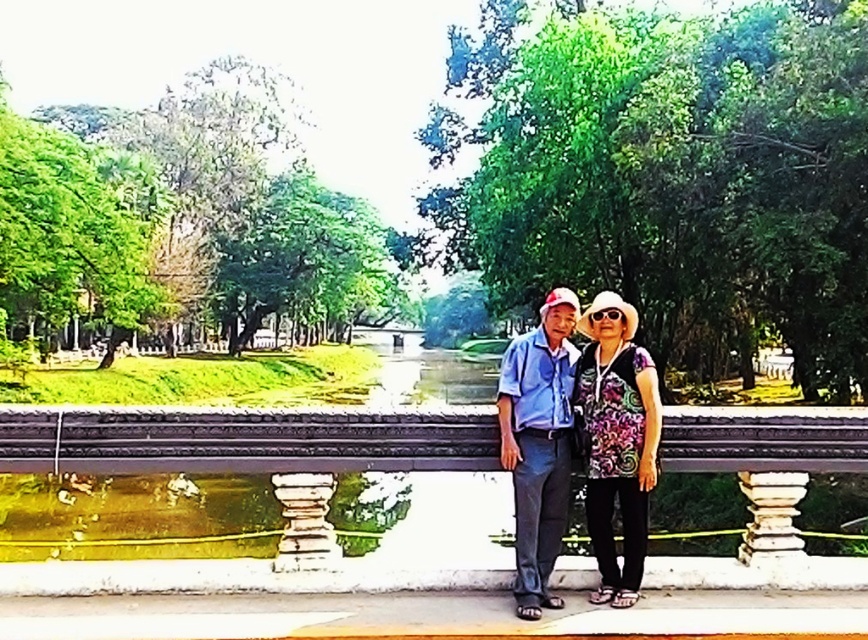
Question: Is black textured rail at center closer to camera compared to blue cotton shirt at center?

Choices:
 (A) no
 (B) yes

Answer: (B)

Question: Can you confirm if black textured rail at center is smaller than blue cotton shirt at center?

Choices:
 (A) yes
 (B) no

Answer: (B)

Question: Which of the following is the closest to the observer?

Choices:
 (A) blue cotton shirt at center
 (B) black textured rail at center

Answer: (B)

Question: Is black textured rail at center bigger than blue cotton shirt at center?

Choices:
 (A) yes
 (B) no

Answer: (A)